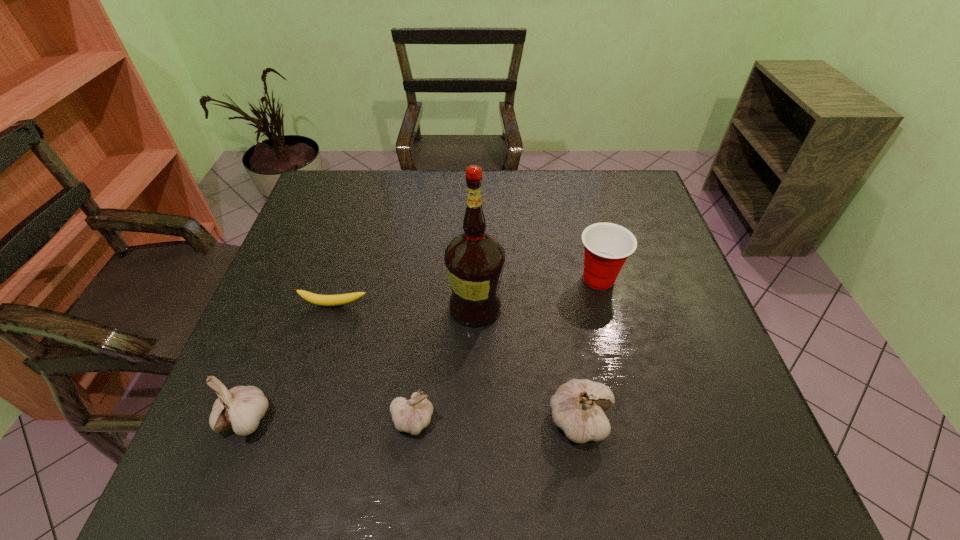
I want to click on free space at the far left corner of the desktop, so click(x=325, y=206).

Where is `blank space at the far right corner`? This screenshot has height=540, width=960. blank space at the far right corner is located at coordinates (612, 193).

Where is `free space at the near right corner`? free space at the near right corner is located at coordinates (720, 412).

Where is `vacant point located between the cup and the alcohol`? Image resolution: width=960 pixels, height=540 pixels. vacant point located between the cup and the alcohol is located at coordinates (537, 293).

Where is `vacant point located between the alcohol and the second tallest garlic`? This screenshot has height=540, width=960. vacant point located between the alcohol and the second tallest garlic is located at coordinates pyautogui.click(x=361, y=363).

The width and height of the screenshot is (960, 540). In order to click on free spot between the fourth object from left to right and the fourth object from right to left in this screenshot , I will do `click(444, 363)`.

You are a GUI agent. You are given a task and a screenshot of the screen. Output one action in this format:
    pyautogui.click(x=<x>, y=<y>)
    Task: Click on the vacant region between the leftmost garlic and the alcohol
    
    Given the screenshot: What is the action you would take?
    pyautogui.click(x=361, y=363)

Image resolution: width=960 pixels, height=540 pixels. I want to click on free space that is in between the banana and the fourth object from left to right, so pos(405,306).

Locate an element on the screen. The image size is (960, 540). free space between the shortest object and the second garlic from left to right is located at coordinates pos(373,362).

This screenshot has height=540, width=960. In order to click on unoccupied position between the rightmost garlic and the third object from right to left in this screenshot , I will do `click(528, 364)`.